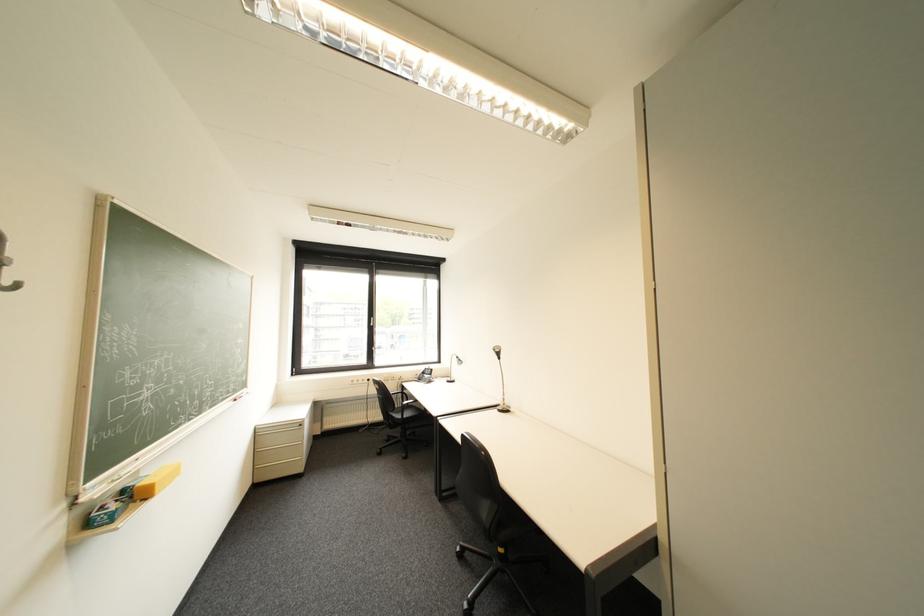
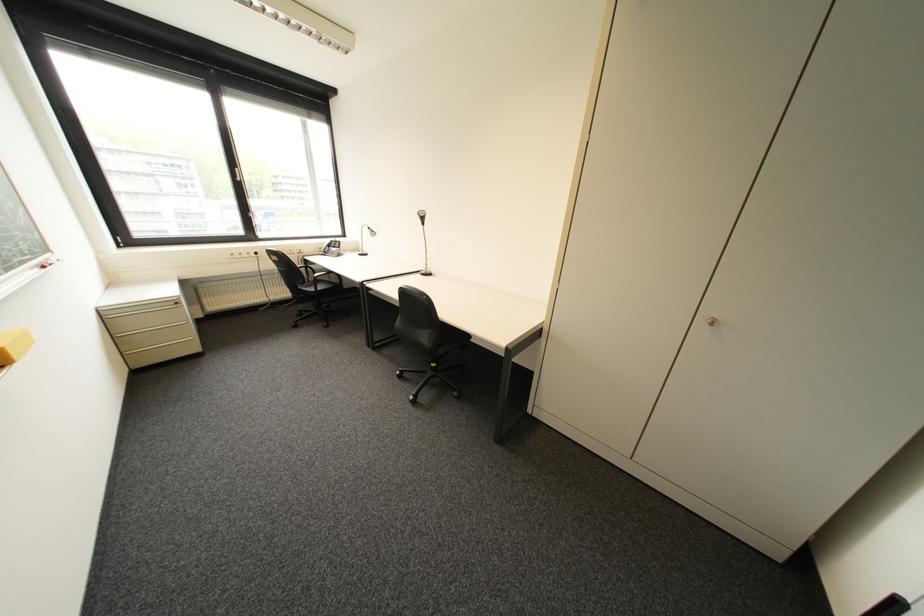
The point at (397, 439) is marked in the first image. Where is the corresponding point in the second image?

(309, 314)